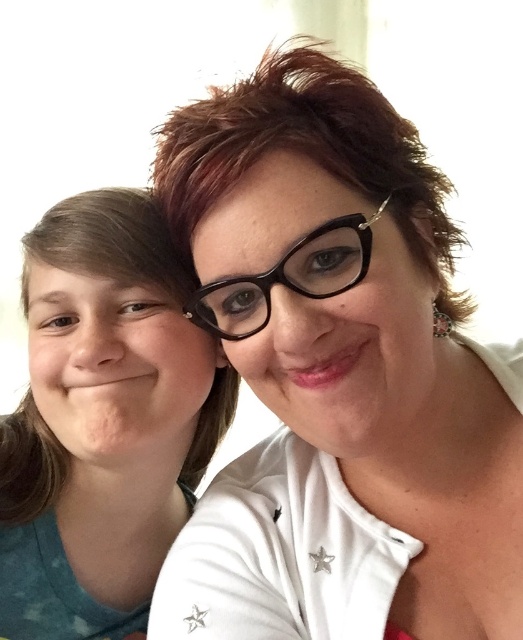
Measure the distance between matte black glasses at upper center and teal fabric shirt at left.

matte black glasses at upper center is 5.52 inches away from teal fabric shirt at left.

Which is in front, point (249, 268) or point (115, 275)?

Point (249, 268) is more forward.

Identify the location of matte black glasses at upper center. The image size is (523, 640). (338, 376).

The image size is (523, 640). Identify the location of matte black glasses at upper center. (338, 376).

Who is lower down, matte black glasses at upper center or black plastic glasses at center?

matte black glasses at upper center is below.

I want to click on matte black glasses at upper center, so click(338, 376).

Between teal fabric shirt at left and black plastic glasses at center, which one has less height?

With less height is black plastic glasses at center.

Where is `teal fabric shirt at left`? Image resolution: width=523 pixels, height=640 pixels. teal fabric shirt at left is located at coordinates (103, 420).

The height and width of the screenshot is (640, 523). In order to click on teal fabric shirt at left in this screenshot , I will do `click(103, 420)`.